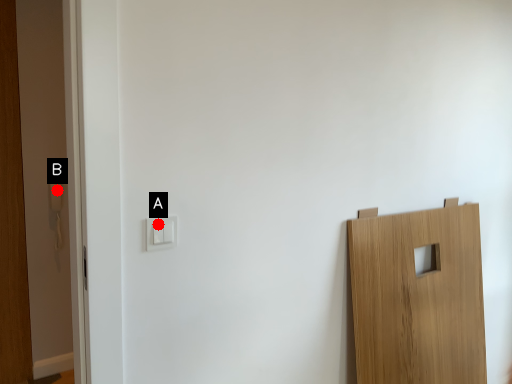
Question: Two points are circled on the image, labeled by A and B beside each circle. Which point is farther from the camera taking this photo?

Choices:
 (A) A is further
 (B) B is further

Answer: (B)